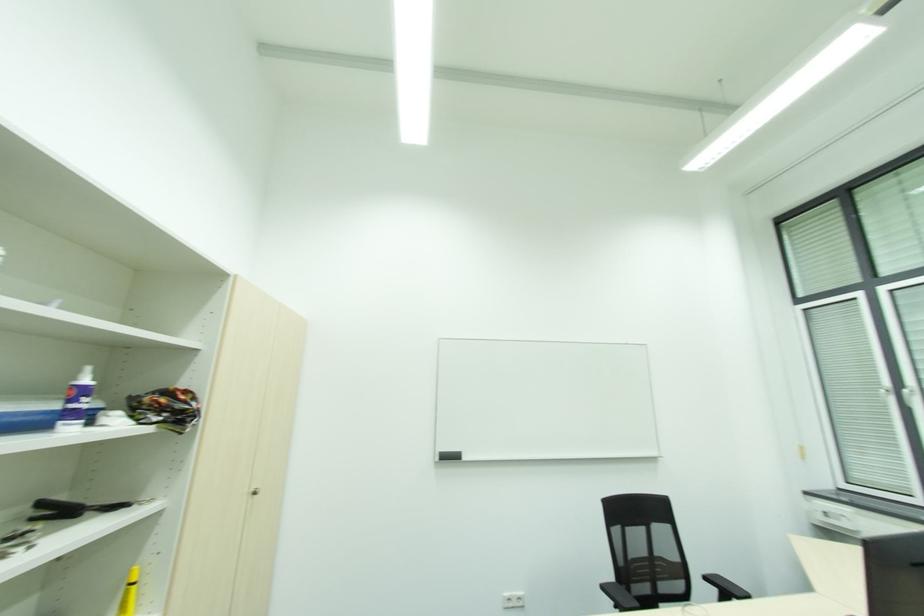
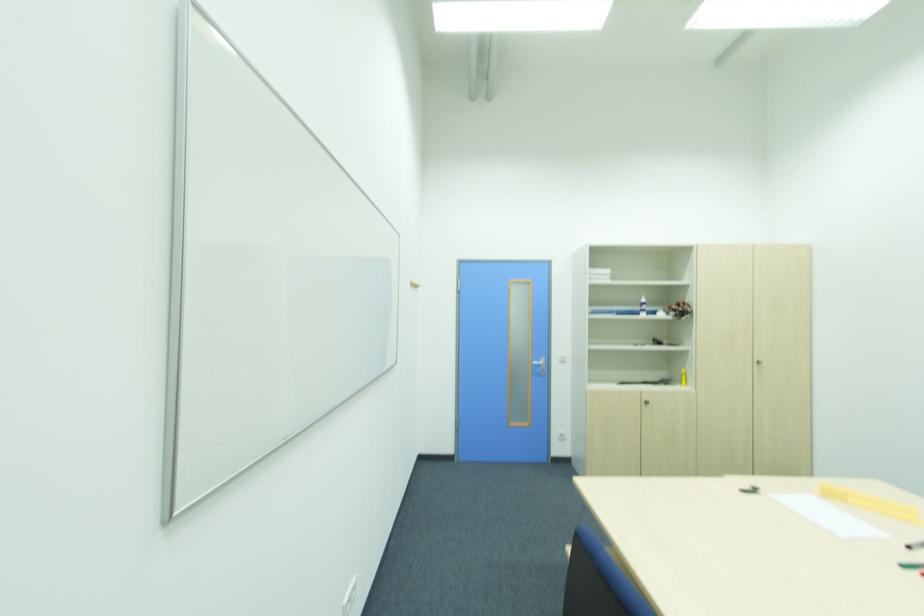
Locate, in the second image, the point that corresponds to (x=79, y=379) in the first image.

(643, 301)